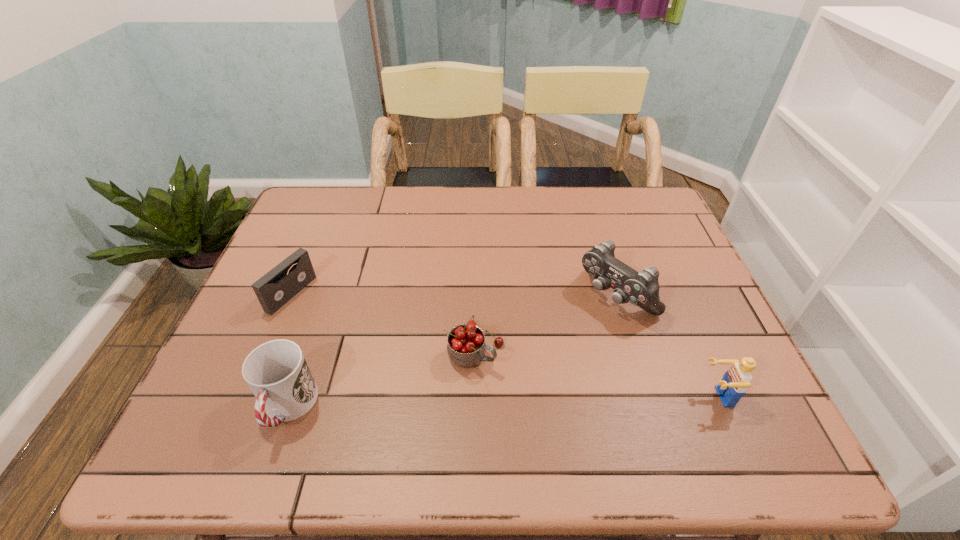
This screenshot has width=960, height=540. In order to click on free space on the desktop that is between the cup and the rightmost object and is positioned on the surface of the control with buttons in this screenshot , I will do `click(473, 403)`.

Locate an element on the screen. vacant space on the desktop that is between the cup and the rightmost object and is positioned on the handle side of the third object from right to left is located at coordinates (x=565, y=401).

You are a GUI agent. You are given a task and a screenshot of the screen. Output one action in this format:
    pyautogui.click(x=<x>, y=<y>)
    Task: Click on the vacant space on the desktop that is between the cup and the rightmost object and is positioned on the front-facing side of the shortest object
    This screenshot has height=540, width=960.
    Given the screenshot: What is the action you would take?
    pyautogui.click(x=517, y=402)